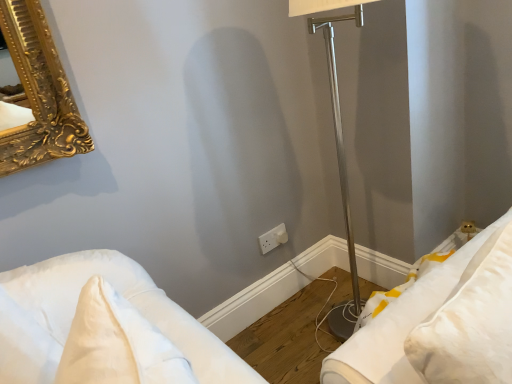
Question: Is white fabric pillow at lower right, the 2th furniture from the left, placed right next to white soft pillow at lower left, the second furniture when ordered from right to left?

Choices:
 (A) yes
 (B) no

Answer: (B)

Question: From a real-world perspective, is white fabric pillow at lower right, the 2th furniture from the left, located higher than white soft pillow at lower left, marked as the 1th furniture in a left-to-right arrangement?

Choices:
 (A) yes
 (B) no

Answer: (B)

Question: From the image's perspective, is white fabric pillow at lower right, the 2th furniture from the left, above white soft pillow at lower left, the second furniture when ordered from right to left?

Choices:
 (A) no
 (B) yes

Answer: (B)

Question: Does white fabric pillow at lower right, the 2th furniture from the left, turn towards white soft pillow at lower left, marked as the 1th furniture in a left-to-right arrangement?

Choices:
 (A) no
 (B) yes

Answer: (A)

Question: From the image's perspective, does white fabric pillow at lower right, the first furniture viewed from the right, appear lower than white soft pillow at lower left, the second furniture when ordered from right to left?

Choices:
 (A) yes
 (B) no

Answer: (B)

Question: Can you confirm if white fabric pillow at lower right, the first furniture viewed from the right, is positioned to the right of white soft pillow at lower left, marked as the 1th furniture in a left-to-right arrangement?

Choices:
 (A) yes
 (B) no

Answer: (A)

Question: Is white plastic electric outlet at center oriented away from white soft pillow at lower left, marked as the 1th furniture in a left-to-right arrangement?

Choices:
 (A) yes
 (B) no

Answer: (B)

Question: Would you say white plastic electric outlet at center is a long distance from white soft pillow at lower left, the second furniture when ordered from right to left?

Choices:
 (A) no
 (B) yes

Answer: (A)

Question: Is white soft pillow at lower left, the second furniture when ordered from right to left, a part of white plastic electric outlet at center?

Choices:
 (A) no
 (B) yes

Answer: (A)

Question: Is white plastic electric outlet at center at the left side of white soft pillow at lower left, marked as the 1th furniture in a left-to-right arrangement?

Choices:
 (A) yes
 (B) no

Answer: (B)

Question: Does white plastic electric outlet at center have a lesser width compared to white soft pillow at lower left, the second furniture when ordered from right to left?

Choices:
 (A) no
 (B) yes

Answer: (B)

Question: Would you say white plastic electric outlet at center is outside white soft pillow at lower left, the second furniture when ordered from right to left?

Choices:
 (A) no
 (B) yes

Answer: (B)

Question: Is white soft pillow at lower left, marked as the 1th furniture in a left-to-right arrangement, to the left of white fabric pillow at lower right, the 2th furniture from the left, from the viewer's perspective?

Choices:
 (A) yes
 (B) no

Answer: (A)